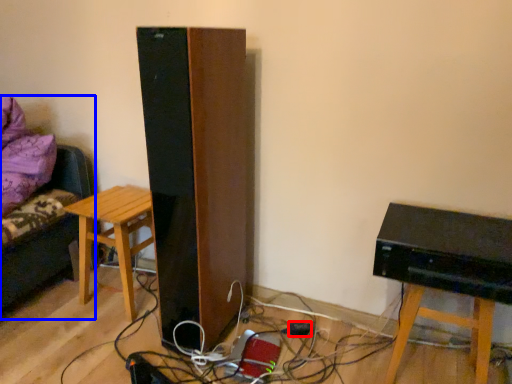
Question: Which point is closer to the camera, plug (highlighted by a red box) or furniture (highlighted by a blue box)?

Choices:
 (A) plug
 (B) furniture

Answer: (B)